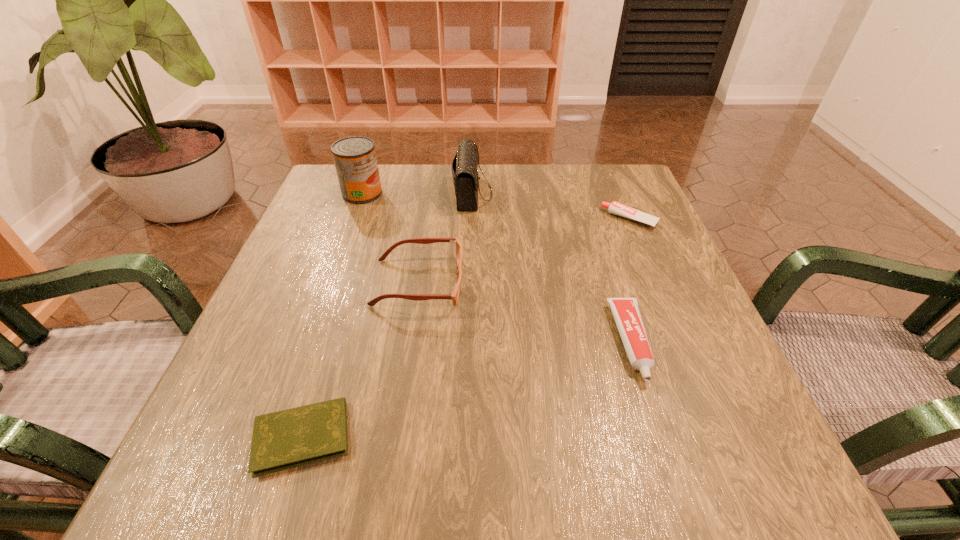
Where is `the tallest object`? The height and width of the screenshot is (540, 960). the tallest object is located at coordinates (355, 160).

I want to click on the fifth shortest object, so click(x=464, y=166).

Locate an element on the screen. This screenshot has height=540, width=960. spectacles is located at coordinates (454, 296).

I want to click on the fourth tallest object, so (626, 313).

Identify the location of the taller toothpaste. (626, 313).

Locate an element on the screen. This screenshot has width=960, height=540. the farther toothpaste is located at coordinates (616, 208).

You are a GUI agent. You are given a task and a screenshot of the screen. Output one action in this format:
    pyautogui.click(x=<x>, y=<y>)
    Task: Click on the fifth tallest object
    This screenshot has height=540, width=960.
    Given the screenshot: What is the action you would take?
    pyautogui.click(x=616, y=208)

Where is `the nearest object`? This screenshot has height=540, width=960. the nearest object is located at coordinates (286, 439).

Find the location of a particular element. The width and height of the screenshot is (960, 540). the shortest object is located at coordinates (286, 439).

The width and height of the screenshot is (960, 540). Identify the location of vacant space located on the right of the can. (455, 193).